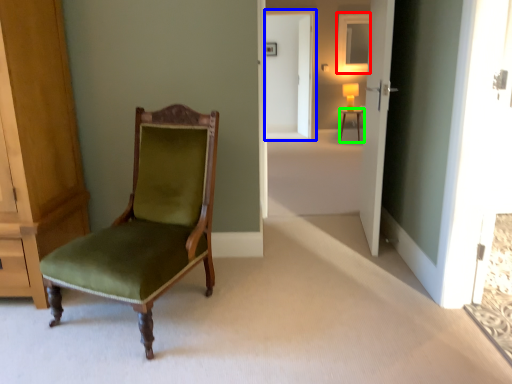
Question: Based on their relative distances, which object is nearer to mirror (highlighted by a red box)? Choose from screen door (highlighted by a blue box) and desk (highlighted by a green box).

Choices:
 (A) screen door
 (B) desk

Answer: (A)